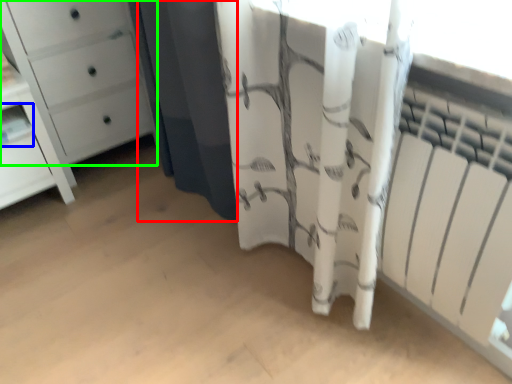
Question: Considering the real-world distances, which object is closest to shower curtain (highlighted by a red box)? shelf (highlighted by a blue box) or chest of drawers (highlighted by a green box).

Choices:
 (A) shelf
 (B) chest of drawers

Answer: (B)